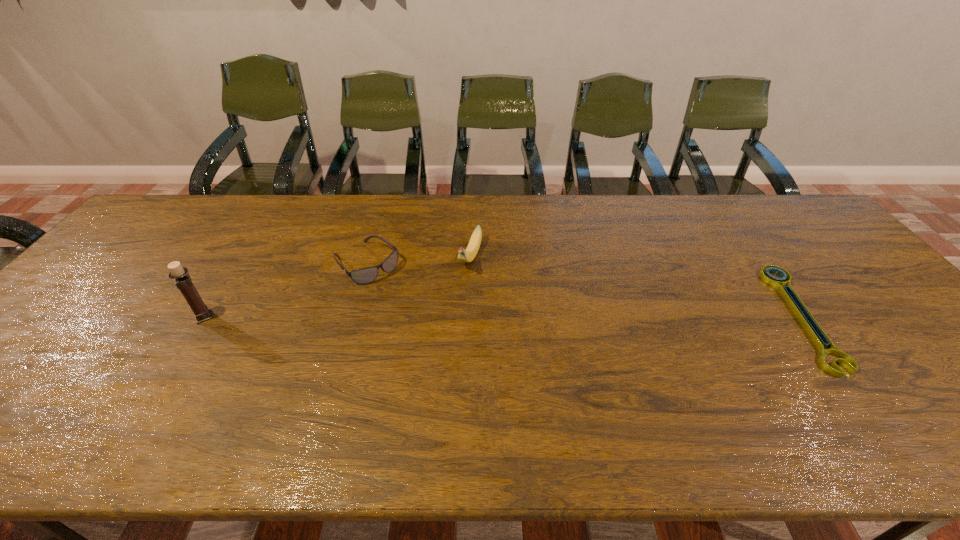
Image resolution: width=960 pixels, height=540 pixels. Find the location of `free location at the right edge`. free location at the right edge is located at coordinates (886, 301).

In the image, there is a desktop. Identify the location of free space at the far right corner. The height and width of the screenshot is (540, 960). (772, 224).

Find the location of a particular element. vacant space that's between the banana and the second object from left to right is located at coordinates (419, 260).

In order to click on free space that is in between the candle holder and the third shortest object in this screenshot , I will do `click(337, 287)`.

You are a GUI agent. You are given a task and a screenshot of the screen. Output one action in this format:
    pyautogui.click(x=<x>, y=<y>)
    Task: Click on the free spot between the banana and the second object from left to right
    The image size is (960, 540).
    Given the screenshot: What is the action you would take?
    pyautogui.click(x=419, y=260)

Where is `vacant point located between the wrench and the third object from left to right`? The width and height of the screenshot is (960, 540). vacant point located between the wrench and the third object from left to right is located at coordinates (636, 287).

Find the location of a particular element. free space between the banana and the candle holder is located at coordinates (337, 287).

Identify the location of blank region between the candle holder and the second tallest object. The height and width of the screenshot is (540, 960). (337, 287).

The width and height of the screenshot is (960, 540). I want to click on empty space between the rightmost object and the candle holder, so click(x=503, y=316).

This screenshot has height=540, width=960. What are the coordinates of `free space between the shortest object and the candle holder` in the screenshot? It's located at (503, 316).